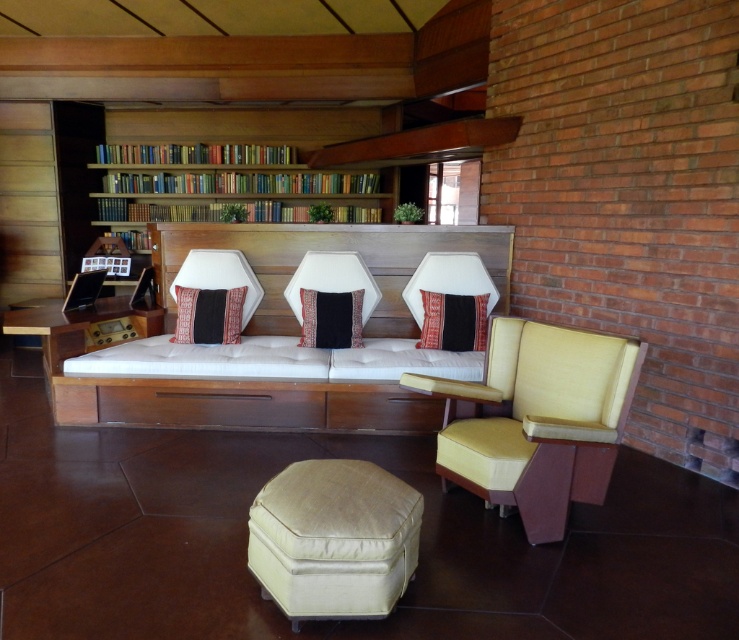
Question: Is white fabric couch at center to the left of textured red pillow at center from the viewer's perspective?

Choices:
 (A) no
 (B) yes

Answer: (A)

Question: Which of the following is the closest to the observer?

Choices:
 (A) (287, 545)
 (B) (508, 481)
 (C) (225, 337)
 (D) (358, 330)

Answer: (A)

Question: Which object appears farthest from the camera in this image?

Choices:
 (A) white fabric couch at center
 (B) beige fabric ottoman at center

Answer: (A)

Question: Which object is farther from the camera taking this photo?

Choices:
 (A) beige fabric ottoman at center
 (B) white fabric couch at center
 (C) patterned fabric pillow at center
 (D) textured red pillow at center

Answer: (B)

Question: Is matte yellow fabric armchair at center right in front of wooden bookshelf at upper center?

Choices:
 (A) yes
 (B) no

Answer: (A)

Question: Is patterned fabric pillow at center positioned before textured red pillow at center?

Choices:
 (A) yes
 (B) no

Answer: (A)